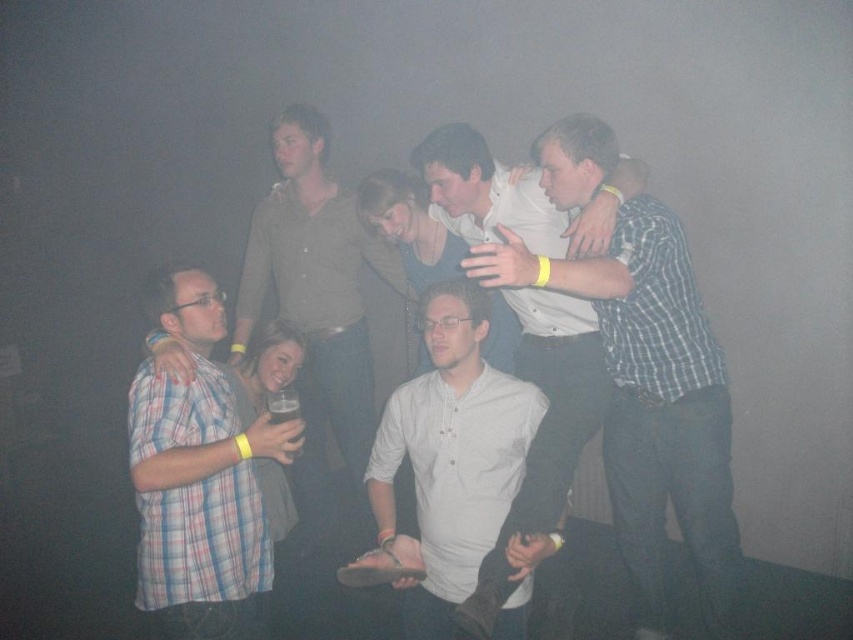
You are standing at the entrance of the venue and want to locate the person wearing the checkered fabric shirt at center. According to the coordinates provided, where should you look to find them?

The checkered fabric shirt at center is located at coordinates point (651, 403).

You are organizing a photo shoot and need to place two models in a frame. The plaid shirt at left and the white matte shirt at center are the subjects. Based on their sizes in the image, which model should be positioned closer to the camera to maintain a balanced composition?

The plaid shirt at left occupies less space than the white matte shirt at center. To maintain a balanced composition, the plaid shirt at left should be positioned closer to the camera since its smaller size can be visually balanced by proximity, while the white matte shirt at center can be placed slightly farther back to avoid overwhelming the frame.